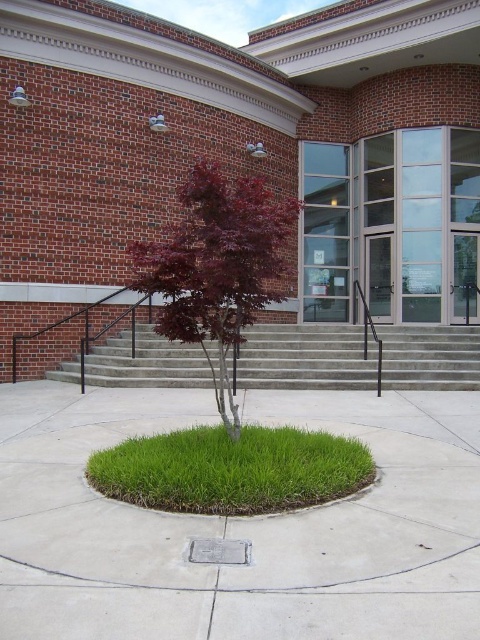
Question: Does glossy red tree at center come in front of green grass at center?

Choices:
 (A) yes
 (B) no

Answer: (B)

Question: Which point is closer to the camera?

Choices:
 (A) gray concrete stairs at center
 (B) green concrete at center
 (C) glossy red tree at center
 (D) green grass at center

Answer: (D)

Question: Based on their relative distances, which object is farther from the green grass at center?

Choices:
 (A) green concrete at center
 (B) glossy red tree at center

Answer: (A)

Question: Does green grass at center lie behind metallic plaque at center?

Choices:
 (A) no
 (B) yes

Answer: (B)

Question: Which object appears closest to the camera in this image?

Choices:
 (A) metallic plaque at center
 (B) glossy red tree at center
 (C) gray concrete stairs at center
 (D) green concrete at center

Answer: (A)

Question: Can you confirm if glossy red tree at center is positioned below metallic plaque at center?

Choices:
 (A) yes
 (B) no

Answer: (B)